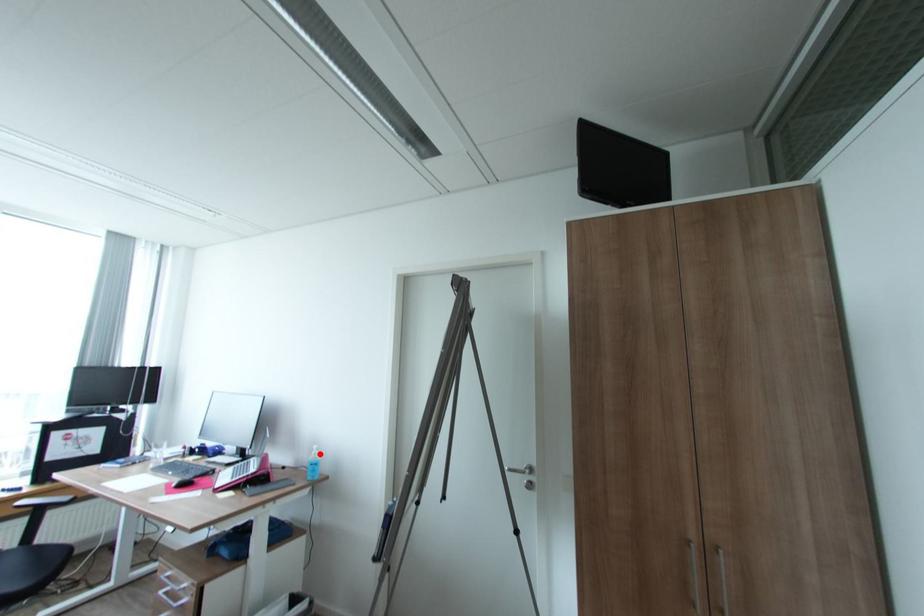
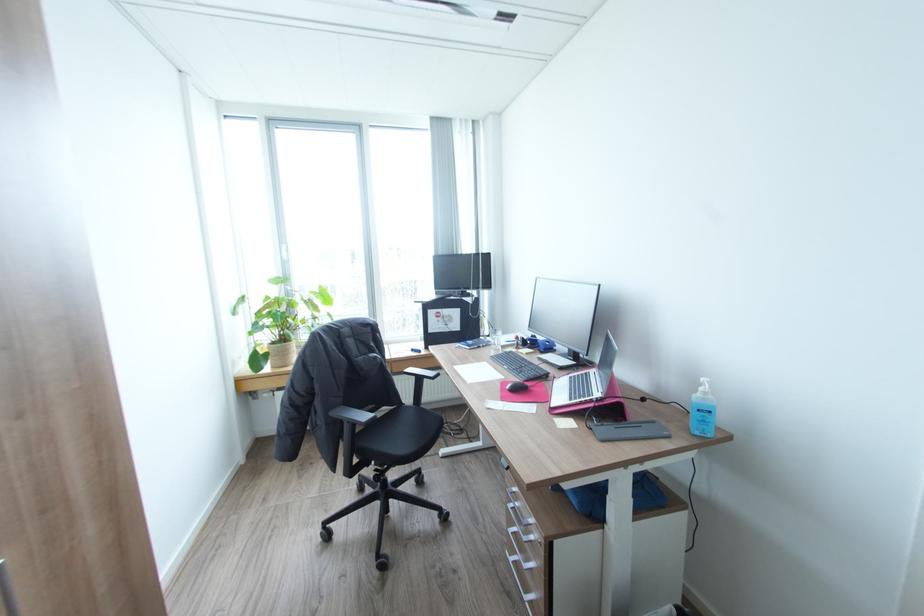
In the second image, find the point that corresponds to the highlighted location in the first image.

(710, 392)